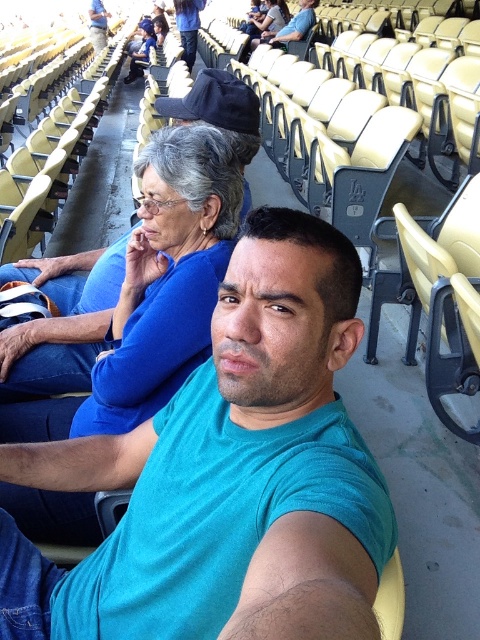
Can you confirm if teal matte t-shirt at center is smaller than blue fabric shirt at upper left?

Indeed, teal matte t-shirt at center has a smaller size compared to blue fabric shirt at upper left.

Where is `teal matte t-shirt at center`? teal matte t-shirt at center is located at coordinates (230, 474).